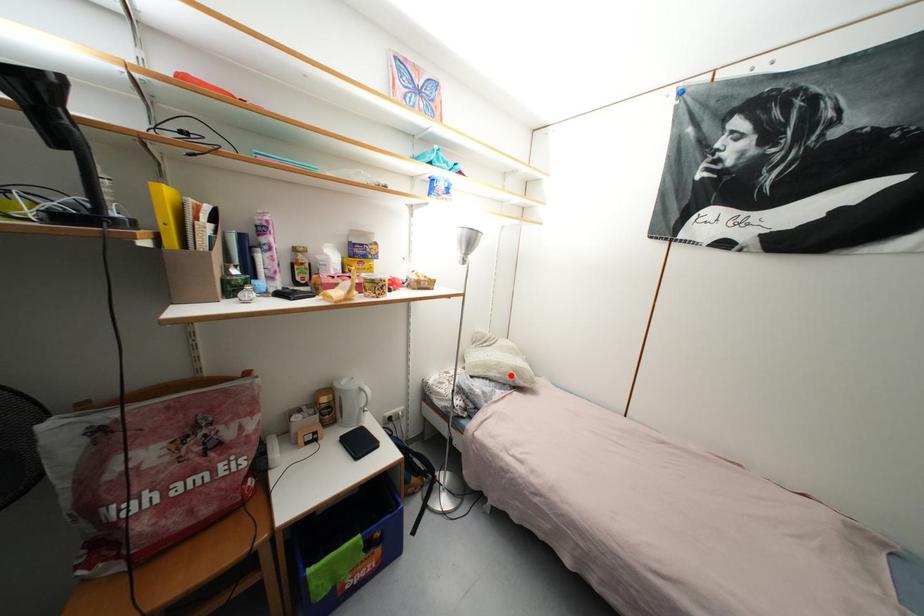
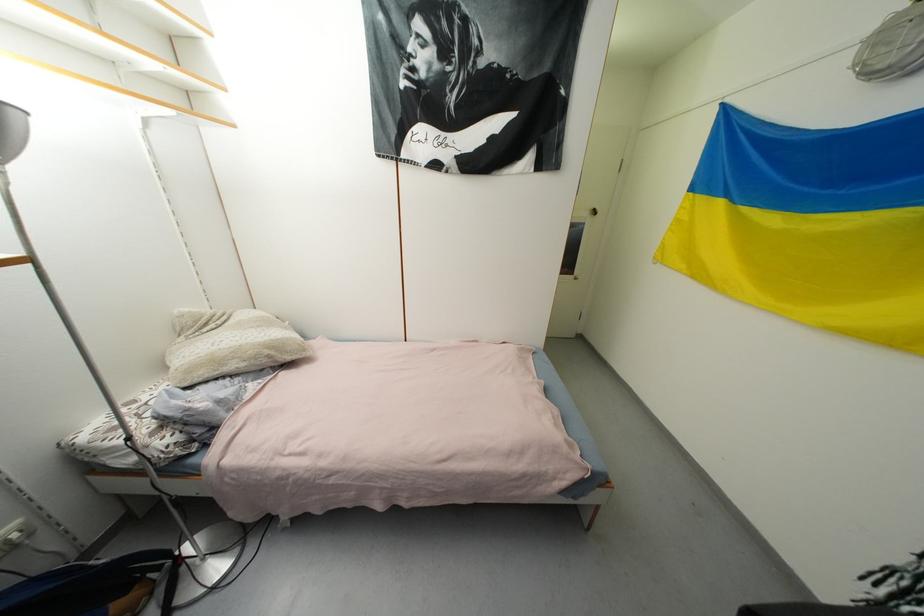
Question: I am providing you with two images of the same scene from different viewpoints. In image1, a red point is highlighted. Considering the same 3D point in image2, which of the following is correct?

Choices:
 (A) It is closer
 (B) It is farther

Answer: (A)